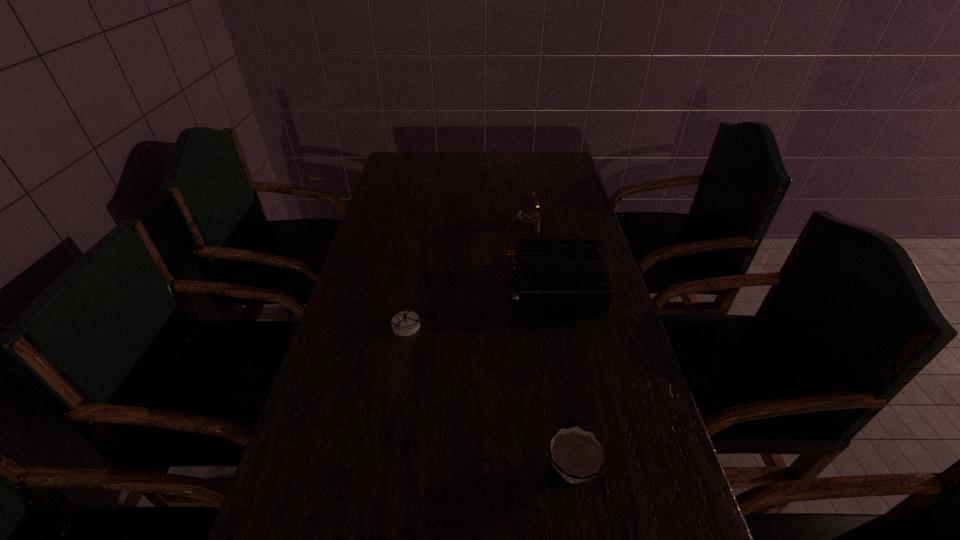
In the image, there is a desktop. At what (x,y) coordinates should I click in order to perform the action: click on vacant space at the far edge. Please return your answer as a coordinate pair (x, y). Image resolution: width=960 pixels, height=540 pixels. Looking at the image, I should click on (461, 152).

Find the location of `vacant space at the left edge of the desktop`. vacant space at the left edge of the desktop is located at coordinates (295, 444).

Identify the location of free region at the right edge of the desktop. The image size is (960, 540). (675, 526).

I want to click on free space at the far left corner of the desktop, so click(x=385, y=180).

Locate an element on the screen. The width and height of the screenshot is (960, 540). vacant space at the far right corner of the desktop is located at coordinates (550, 163).

The width and height of the screenshot is (960, 540). Identify the location of vacant point located between the taller compass and the cup. (549, 343).

You are a GUI agent. You are given a task and a screenshot of the screen. Output one action in this format:
    pyautogui.click(x=<x>, y=<y>)
    Task: Click on the free space between the shortest object and the router
    Image resolution: width=960 pixels, height=540 pixels.
    Given the screenshot: What is the action you would take?
    pyautogui.click(x=481, y=306)

I want to click on free space between the taller compass and the cup, so click(x=549, y=343).

Find the location of a particular element. This screenshot has height=540, width=960. free space between the router and the nearest object is located at coordinates (563, 376).

This screenshot has width=960, height=540. I want to click on free space between the leftmost object and the taller compass, so click(x=468, y=273).